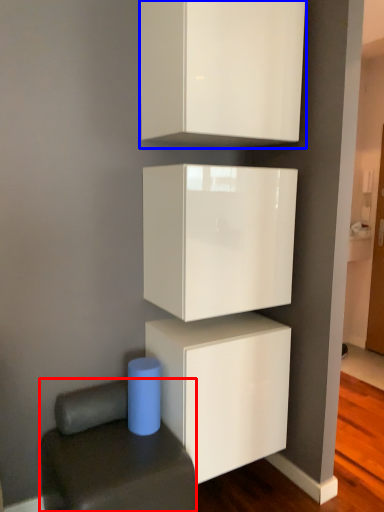
Question: Which of the following is the closest to the observer, furniture (highlighted by a red box) or cabinetry (highlighted by a blue box)?

Choices:
 (A) furniture
 (B) cabinetry

Answer: (A)